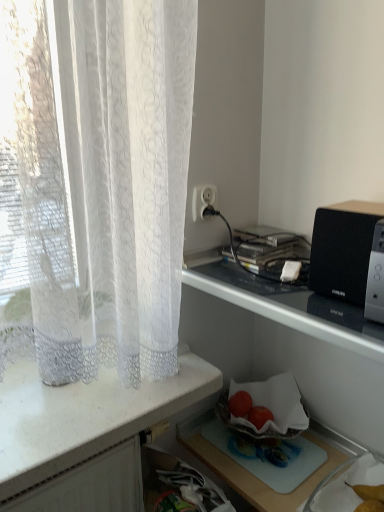
Question: Can you confirm if white plastic socket at upper center is thinner than metallic silver microwave at upper right?

Choices:
 (A) no
 (B) yes

Answer: (B)

Question: Is white plastic socket at upper center turned away from metallic silver microwave at upper right?

Choices:
 (A) no
 (B) yes

Answer: (A)

Question: Considering the relative sizes of white plastic socket at upper center and metallic silver microwave at upper right in the image provided, is white plastic socket at upper center wider than metallic silver microwave at upper right?

Choices:
 (A) no
 (B) yes

Answer: (A)

Question: From a real-world perspective, is white plastic socket at upper center located higher than metallic silver microwave at upper right?

Choices:
 (A) no
 (B) yes

Answer: (B)

Question: Is white plastic socket at upper center oriented towards metallic silver microwave at upper right?

Choices:
 (A) no
 (B) yes

Answer: (A)

Question: Is red matte tomato at lower center, marked as the 2th fruit in a right-to-left arrangement, in front of or behind yellow matte pear at lower right in the image?

Choices:
 (A) front
 (B) behind

Answer: (B)

Question: Looking at the image, does red matte tomato at lower center, which is the 1th fruit from left to right, seem bigger or smaller compared to yellow matte pear at lower right?

Choices:
 (A) small
 (B) big

Answer: (A)

Question: Would you say red matte tomato at lower center, marked as the 2th fruit in a right-to-left arrangement, is to the left or to the right of yellow matte pear at lower right in the picture?

Choices:
 (A) left
 (B) right

Answer: (A)

Question: Is red matte tomato at lower center, which is the 1th fruit from left to right, wider or thinner than yellow matte pear at lower right?

Choices:
 (A) thin
 (B) wide

Answer: (A)

Question: From the image's perspective, is white lace curtain at left positioned above or below translucent glass bowl at lower center?

Choices:
 (A) above
 (B) below

Answer: (A)

Question: From a real-world perspective, is white lace curtain at left physically located above or below translucent glass bowl at lower center?

Choices:
 (A) above
 (B) below

Answer: (A)

Question: Based on their sizes in the image, would you say white lace curtain at left is bigger or smaller than translucent glass bowl at lower center?

Choices:
 (A) big
 (B) small

Answer: (A)

Question: In terms of height, does white lace curtain at left look taller or shorter compared to translucent glass bowl at lower center?

Choices:
 (A) short
 (B) tall

Answer: (B)

Question: From a real-world perspective, is black plastic speaker at upper right physically located above or below white lace curtain at left?

Choices:
 (A) below
 (B) above

Answer: (B)

Question: From the image's perspective, is black plastic speaker at upper right above or below white lace curtain at left?

Choices:
 (A) below
 (B) above

Answer: (B)